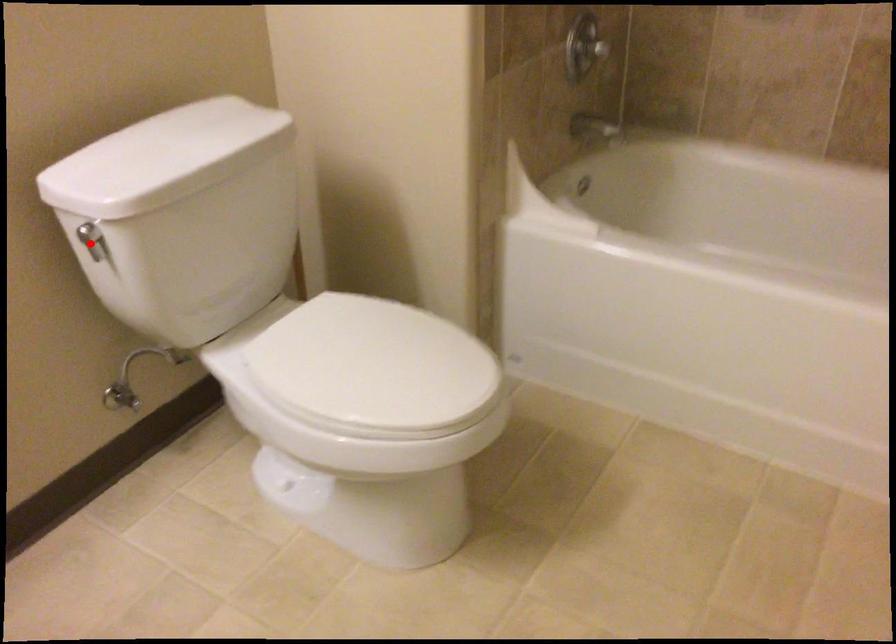
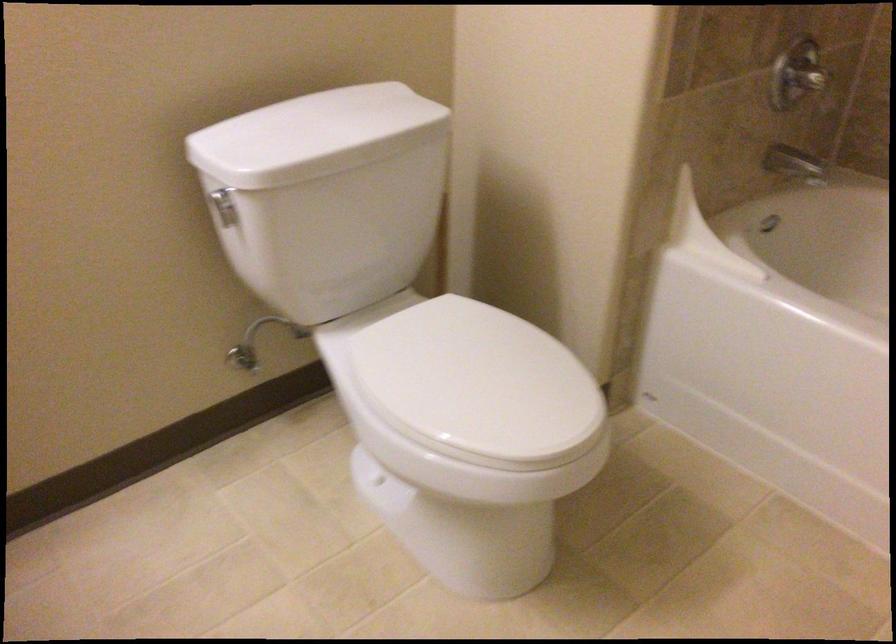
The point at the highlighted location is marked in the first image. Where is the corresponding point in the second image?

(224, 205)